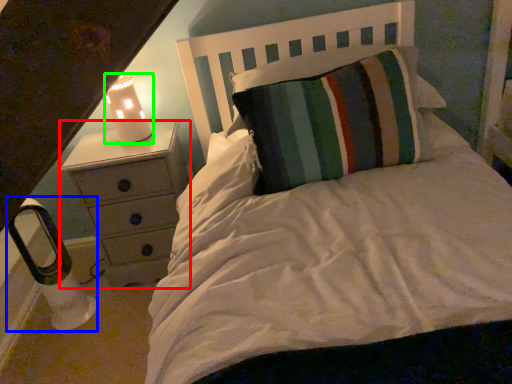
Question: Which object is positioned farthest from chest of drawers (highlighted by a red box)? Select from lamp (highlighted by a blue box) and lamp (highlighted by a green box).

Choices:
 (A) lamp
 (B) lamp

Answer: (A)